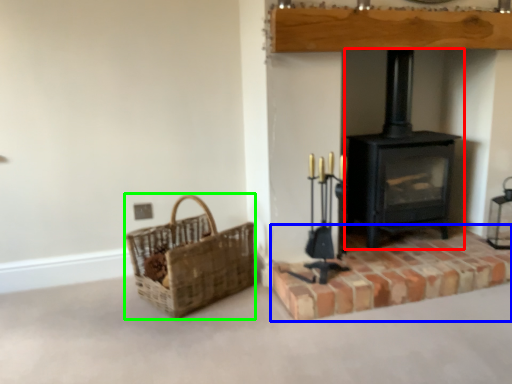
Question: Which is farther away from wood burning stove (highlighted by a red box)? brickwork (highlighted by a blue box) or basket (highlighted by a green box)?

Choices:
 (A) brickwork
 (B) basket

Answer: (B)